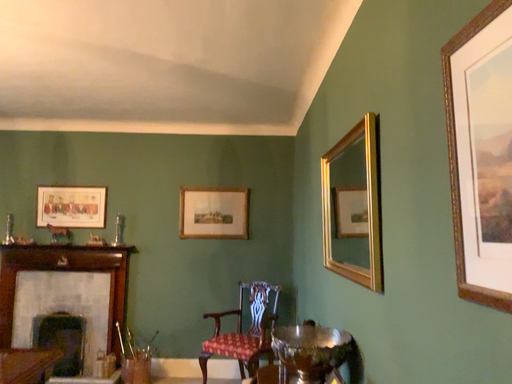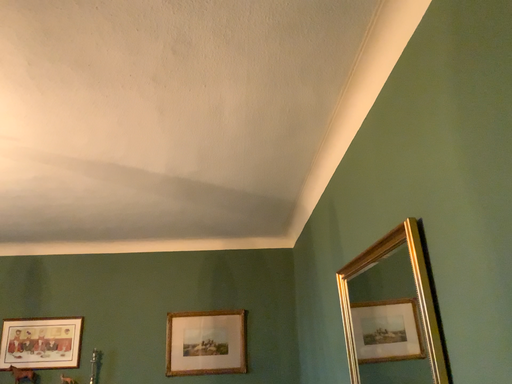
Question: How did the camera likely rotate when shooting the video?

Choices:
 (A) rotated downward
 (B) rotated upward

Answer: (B)